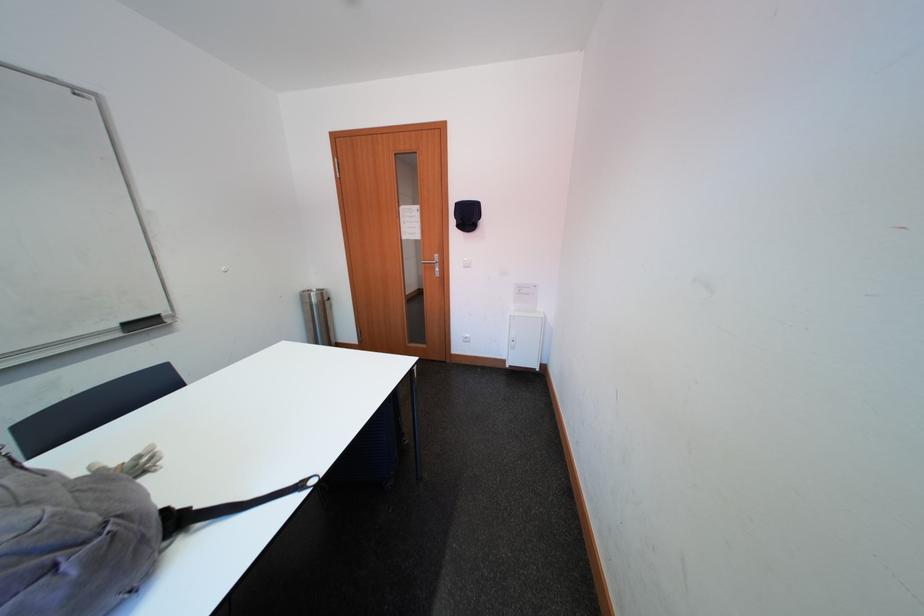
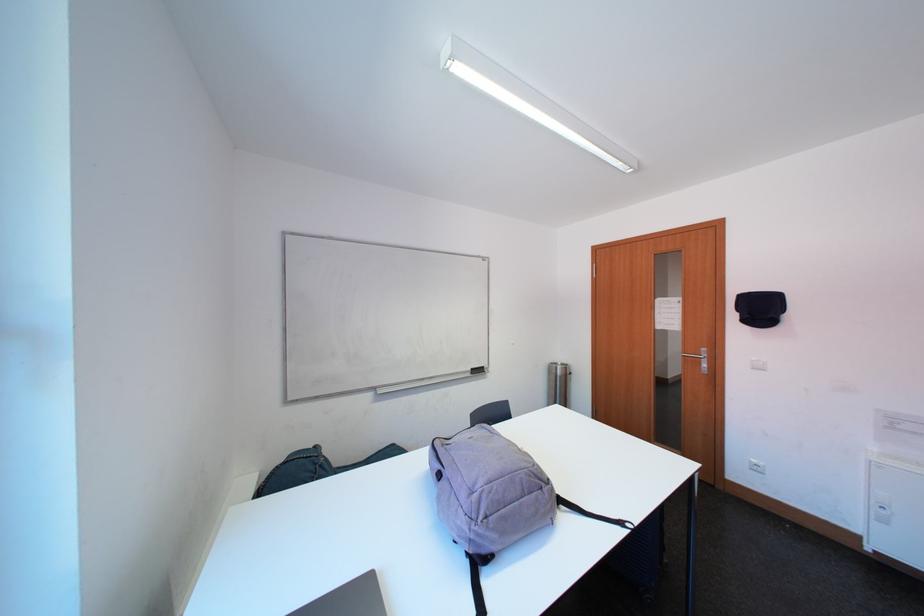
The point at [320,299] is marked in the first image. Where is the corresponding point in the second image?

(565, 371)